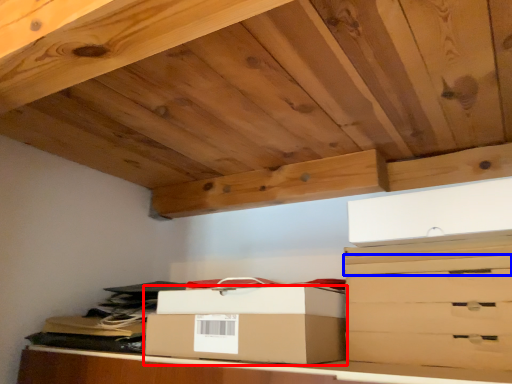
Question: Among these objects, which one is nearest to the camera, box (highlighted by a red box) or drawer (highlighted by a blue box)?

Choices:
 (A) box
 (B) drawer

Answer: (B)